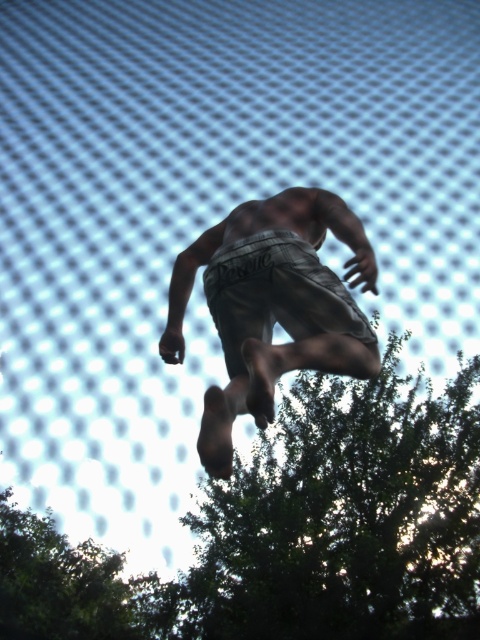
Who is shorter, green leafy tree at lower right or gray cotton shorts at center?

green leafy tree at lower right

Does point (363, 516) come in front of point (158, 348)?

No, (363, 516) is further to viewer.

Where is `green leafy tree at lower right`? This screenshot has width=480, height=640. green leafy tree at lower right is located at coordinates (346, 516).